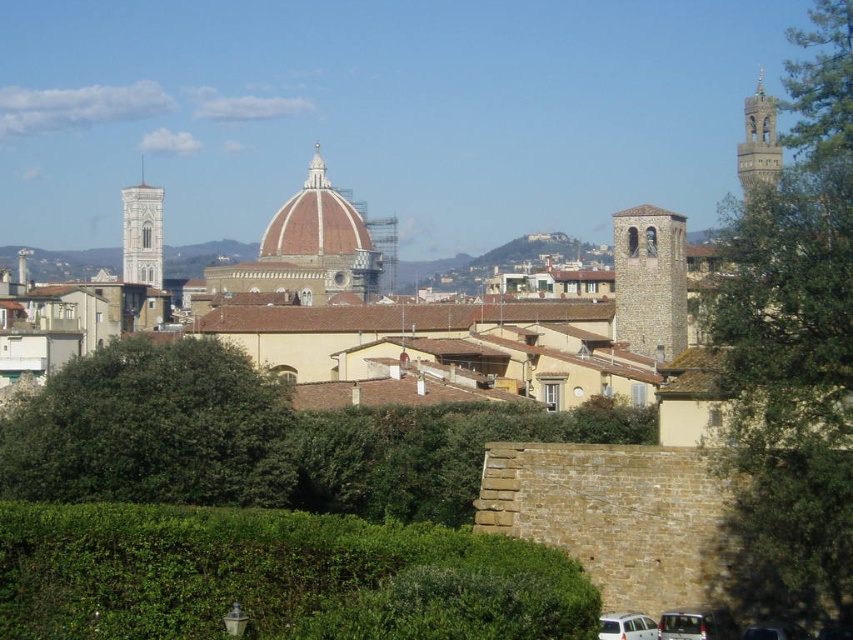
Is green leafy tree at center positioned before stone bell tower at left?

Yes, green leafy tree at center is in front of stone bell tower at left.

Can you confirm if green leafy tree at center is positioned to the left of stone bell tower at left?

No, green leafy tree at center is not to the left of stone bell tower at left.

Identify the location of green leafy tree at center. (152, 429).

Who is more forward, (756,412) or (659,620)?

Point (756,412) is in front.

Where is `green leafy tree at right`? Image resolution: width=853 pixels, height=640 pixels. green leafy tree at right is located at coordinates (793, 349).

Who is more forward, [746,340] or [669,612]?

A: Positioned in front is point [746,340].

The width and height of the screenshot is (853, 640). Identify the location of green leafy tree at right. (793, 349).

Is green leafy hedge at lower center to the left of green leafy hedge at center from the viewer's perspective?

Correct, you'll find green leafy hedge at lower center to the left of green leafy hedge at center.

At what (x,y) coordinates should I click in order to perform the action: click on green leafy hedge at lower center. Please return your answer as a coordinate pair (x, y). Looking at the image, I should click on (274, 577).

You are a GUI agent. You are given a task and a screenshot of the screen. Output one action in this format:
    pyautogui.click(x=<x>, y=<y>)
    Task: Click on the green leafy hedge at lower center
    The width and height of the screenshot is (853, 640).
    Given the screenshot: What is the action you would take?
    pyautogui.click(x=274, y=577)